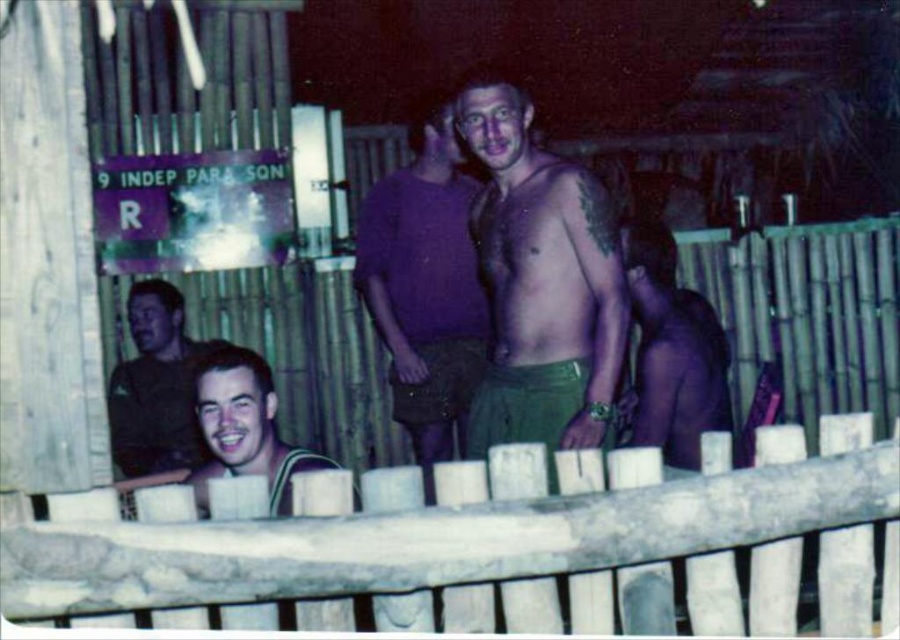
Question: Estimate the real-world distances between objects in this image. Which object is closer to the shiny purple shirt at center?

Choices:
 (A) green jersey at center
 (B) white wood fence at lower center
 (C) green cotton shorts at center

Answer: (C)

Question: Is purple knit sweater at center further to camera compared to shiny purple shirt at center?

Choices:
 (A) yes
 (B) no

Answer: (A)

Question: Can you confirm if purple knit sweater at center is bigger than shiny purple shirt at center?

Choices:
 (A) no
 (B) yes

Answer: (B)

Question: Which is nearer to the shiny purple shirt at center?

Choices:
 (A) green jersey at center
 (B) purple knit sweater at center
 (C) matte brown shirt at lower left

Answer: (B)

Question: Does green cotton shorts at center appear over shiny purple shirt at center?

Choices:
 (A) no
 (B) yes

Answer: (B)

Question: Which point appears farthest from the camera in this image?

Choices:
 (A) (153, 326)
 (B) (544, 285)
 (C) (649, 342)

Answer: (A)